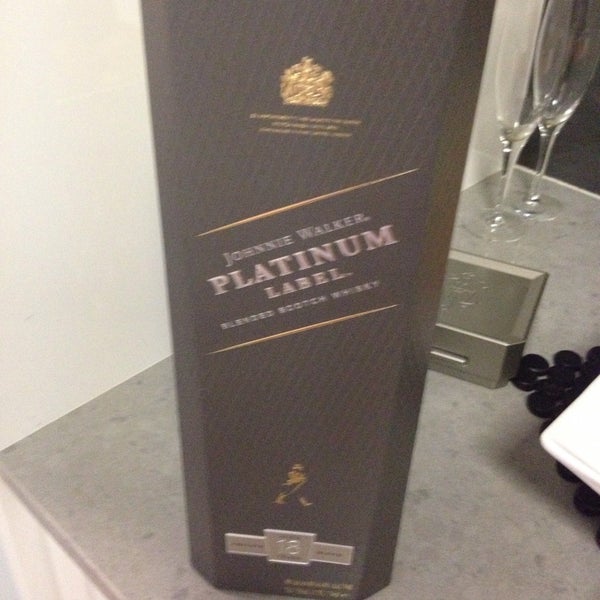
Locate an element on the screen. Image resolution: width=600 pixels, height=600 pixels. gray marble countertop is located at coordinates (44, 475), (494, 518), (576, 259), (443, 520).